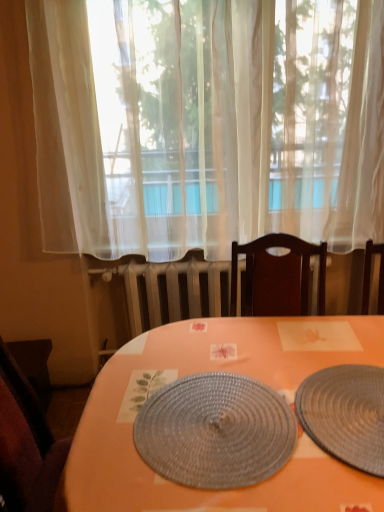
Find the location of a particular element. Image resolution: width=384 pixels, height=512 pixels. vacant space behind rattan placemat at center, positioned as the first plate in right-to-left order is located at coordinates (309, 341).